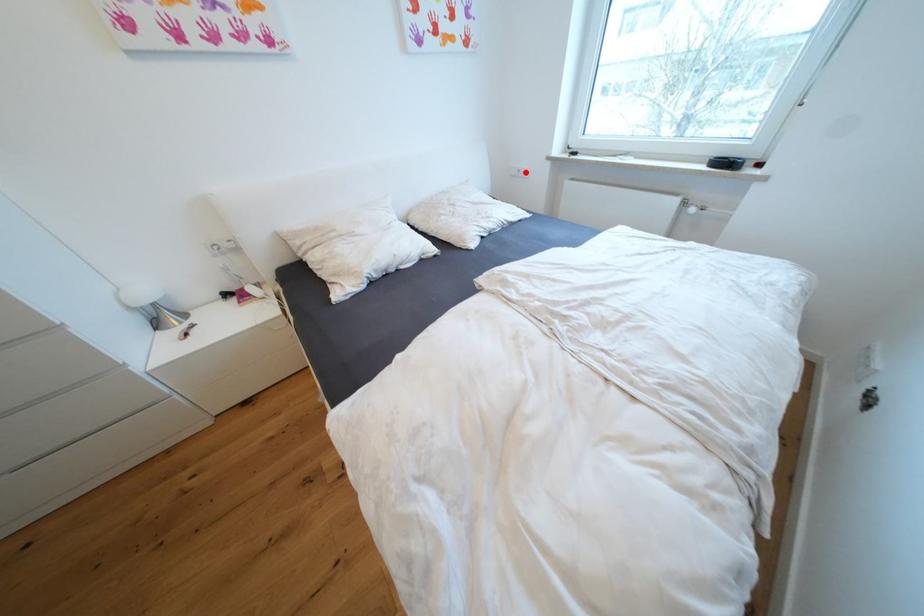
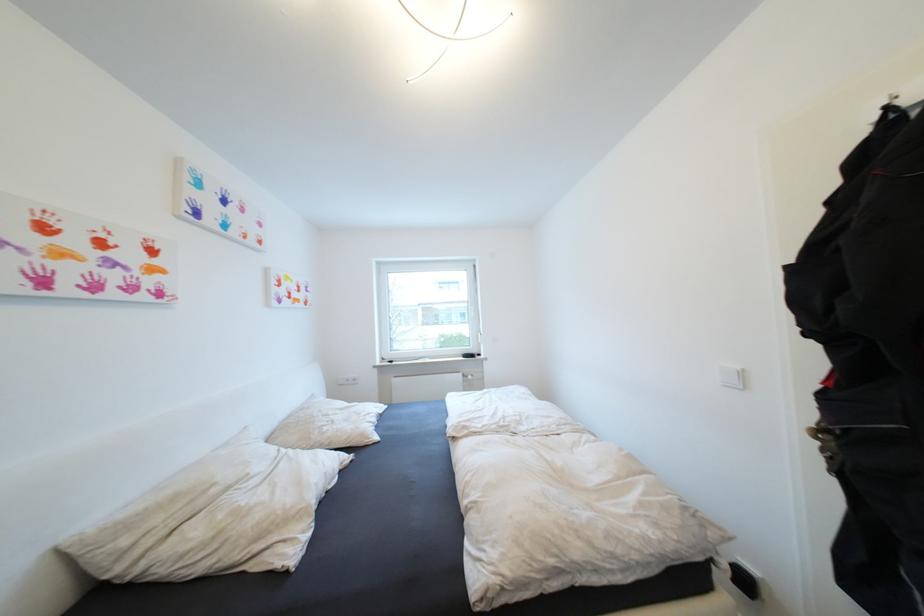
Question: I am providing you with two images of the same scene from different viewpoints. A red point is shown in image1. For the corresponding object point in image2, is it positioned nearer or farther from the camera?

Choices:
 (A) Nearer
 (B) Farther

Answer: (B)